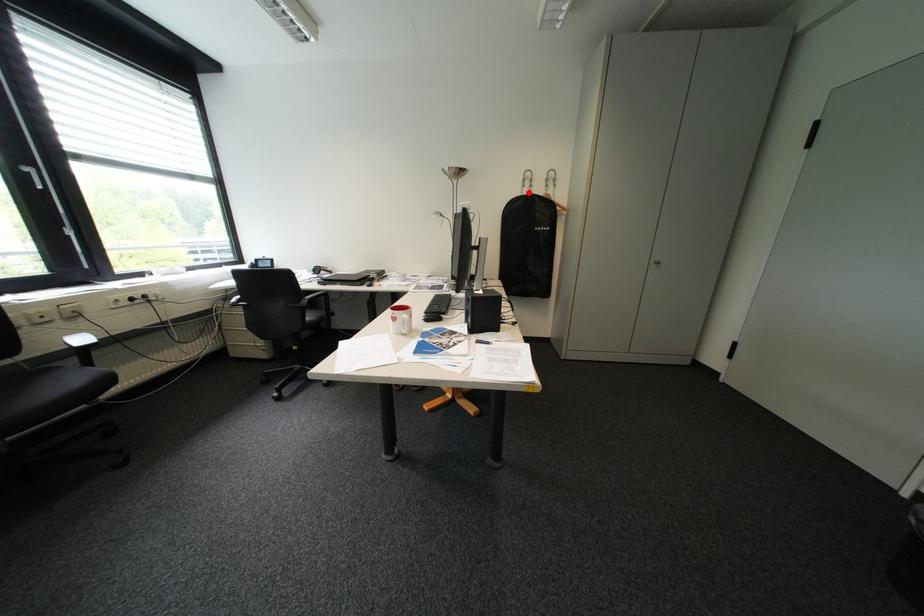
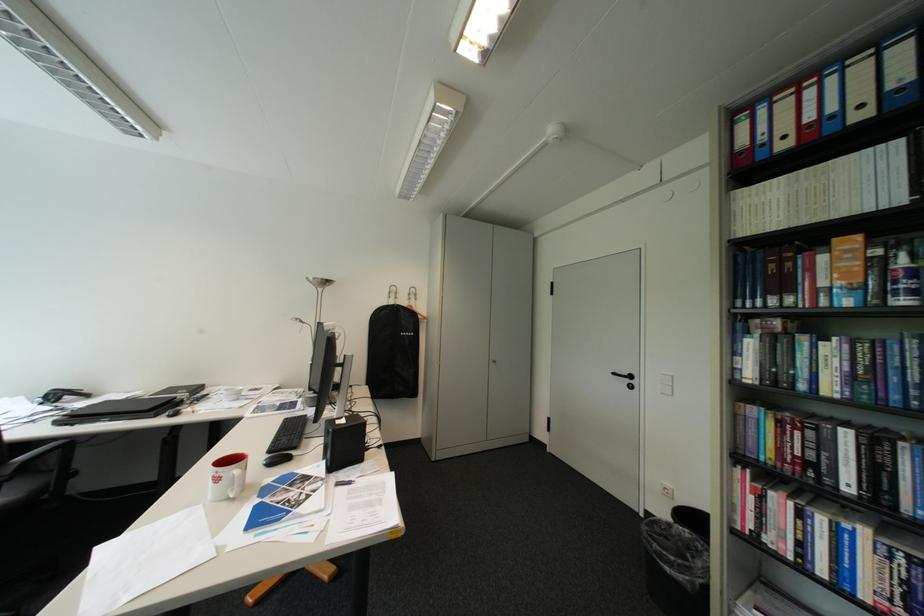
Where in the second image is the point corresponding to the highlighted location from the first image?

(395, 302)